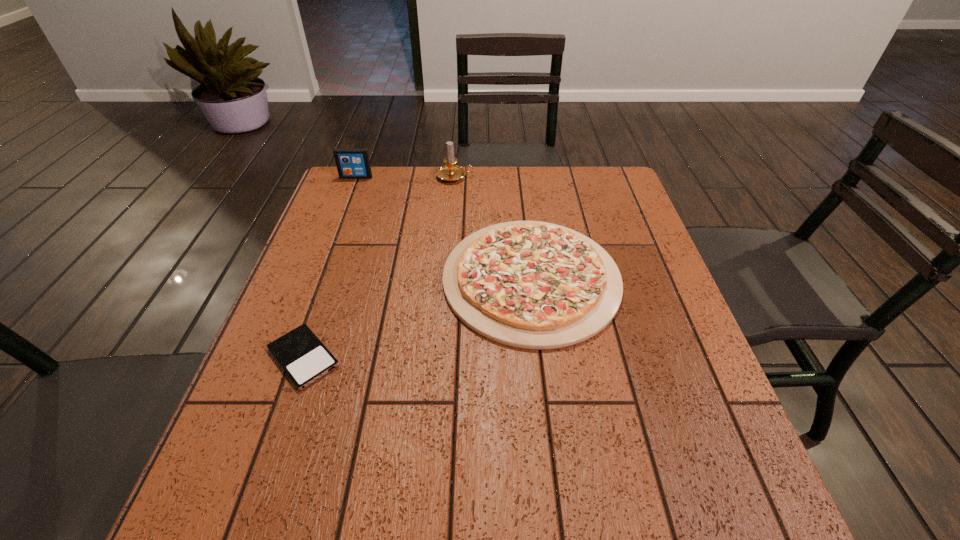
At what (x,y) coordinates should I click in order to perform the action: click on candle that is at the far edge. Please return your answer as a coordinate pair (x, y). Looking at the image, I should click on (x=450, y=172).

Image resolution: width=960 pixels, height=540 pixels. I want to click on iPod that is at the far edge, so click(352, 163).

Where is `object at the right edge`? The height and width of the screenshot is (540, 960). object at the right edge is located at coordinates (535, 285).

Locate an element on the screen. This screenshot has width=960, height=540. object at the far left corner is located at coordinates (352, 163).

Image resolution: width=960 pixels, height=540 pixels. In the image, there is a desktop. Find the location of `vacant space at the far edge`. vacant space at the far edge is located at coordinates (435, 201).

The width and height of the screenshot is (960, 540). I want to click on vacant area at the left edge, so click(333, 306).

Find the location of a particular element. This screenshot has height=540, width=960. vacant space at the right edge is located at coordinates (637, 421).

Find the location of a particular element. This screenshot has width=960, height=540. free space at the far left corner of the desktop is located at coordinates (382, 167).

At what (x,y) coordinates should I click in order to perform the action: click on free space at the far right corner. Please return your answer as a coordinate pair (x, y). The width and height of the screenshot is (960, 540). Looking at the image, I should click on (576, 174).

I want to click on free area in between the farther iPod and the second shortest object, so click(444, 228).